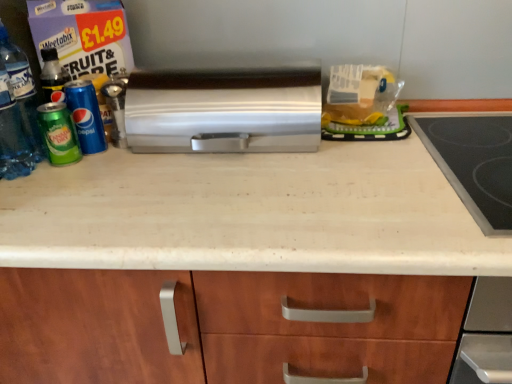
The image size is (512, 384). I want to click on free space in front of satin silver toaster at center, so click(x=240, y=205).